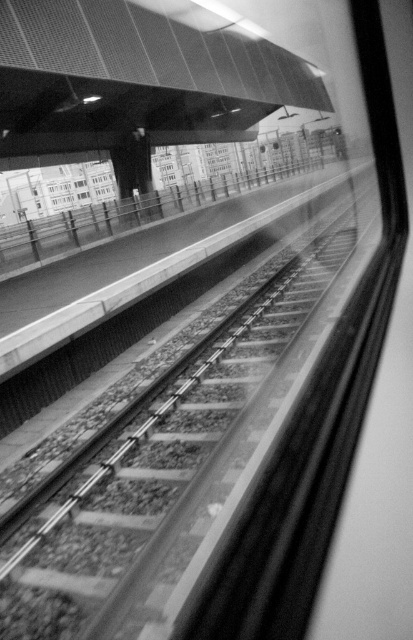
You are a passenger on the train and want to look out through the transparent glass window at center and the transparent glass window at upper center. Which window would allow you to see the platform railing more clearly?

The transparent glass window at center is further to the viewer than the transparent glass window at upper center, so the transparent glass window at center would allow you to see the platform railing more clearly because it is closer to you.

You are inside a moving train and want to look outside through the transparent glass windows. Which window, the transparent glass window at center or the transparent glass window at upper center, allows you to see a wider view of the platform?

The transparent glass window at center allows a wider view of the platform since its width surpasses that of the transparent glass window at upper center.